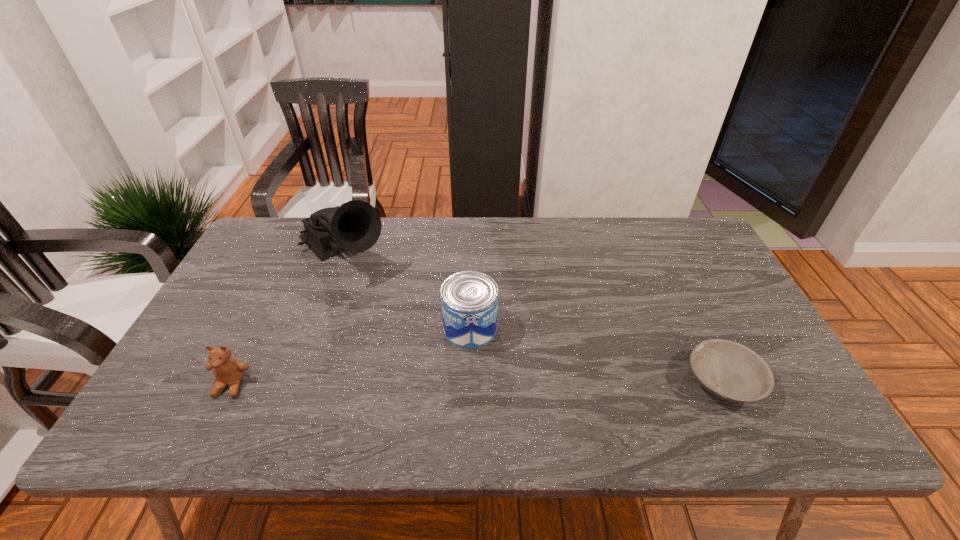
At what (x,y) coordinates should I click in order to perform the action: click on the second closest object to the phonograph_record. Please return your answer as a coordinate pair (x, y). Looking at the image, I should click on (228, 371).

I want to click on object that is the nearest to the shortest object, so click(469, 300).

Find the location of a particular element. The image size is (960, 540). free space that satisfies the following two spatial constraints: 1. on the front side of the rightmost object; 2. on the right side of the tallest object is located at coordinates (296, 381).